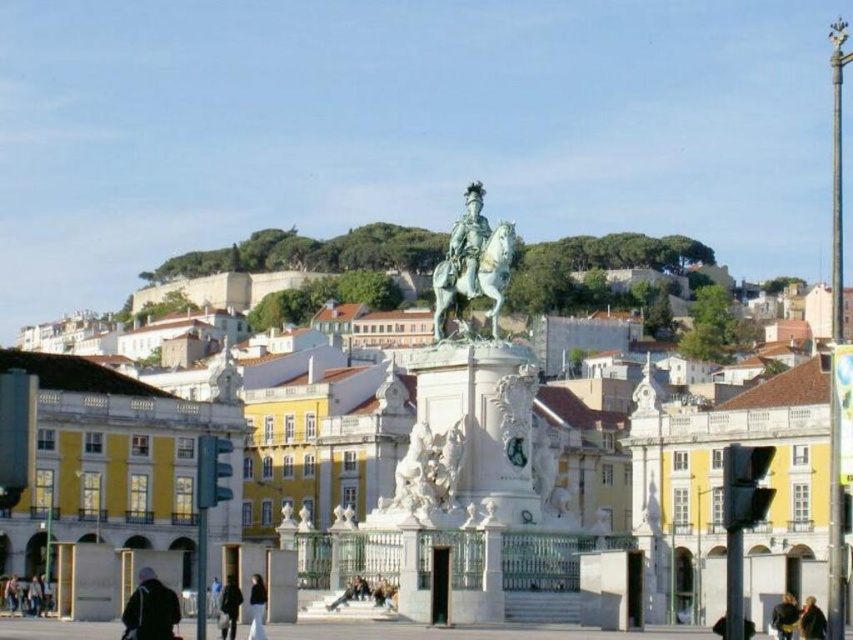
Does white marble statue at center appear on the left side of dark gray jacket at lower left?

In fact, white marble statue at center is to the right of dark gray jacket at lower left.

Consider the image. Who is positioned more to the right, white marble statue at center or dark gray jacket at lower left?

white marble statue at center

Is point (201, 582) closer to viewer compared to point (158, 612)?

No, it is behind (158, 612).

Identify the location of white marble statue at center. This screenshot has height=640, width=853. (469, 448).

Who is higher up, green patina horse at center or dark brown leather jacket at lower right?

Positioned higher is green patina horse at center.

Image resolution: width=853 pixels, height=640 pixels. I want to click on green patina horse at center, so click(x=495, y=269).

The image size is (853, 640). Identify the location of green patina horse at center. (495, 269).

Can you confirm if green patina horse at center is bigger than dark brown leather jacket at lower center?

Yes.

Does green patina horse at center come behind dark brown leather jacket at lower center?

Yes, it is behind dark brown leather jacket at lower center.

Does point (502, 276) come closer to viewer compared to point (229, 580)?

No, (502, 276) is further to viewer.

Identify the location of green patina horse at center. (495, 269).